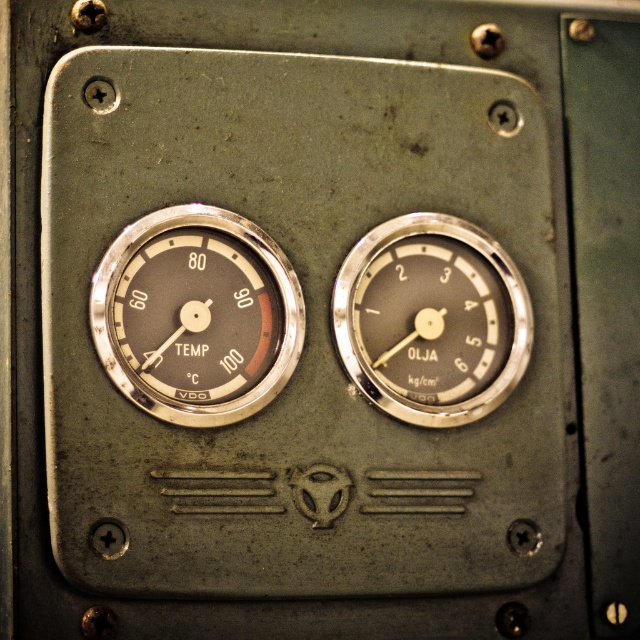
You are a mechanic inspecting a vehicle dashboard. You notice two gauges on the panel. The matte silver gauge at upper left and the metallic silver gauge at center. Which gauge is taller?

The metallic silver gauge at center is taller than the matte silver gauge at upper left.

From the picture: You are a mechanic inspecting a vehicle panel. You see the matte silver gauge at upper left and the metallic silver gauge at center. Which gauge is located to the left of the other?

The matte silver gauge at upper left is positioned on the left side of metallic silver gauge at center.

You are a mechanic inspecting a vehicle dashboard. You see the matte silver gauge at upper left and the metallic silver gauge at center. Which gauge is positioned higher on the panel?

The matte silver gauge at upper left is positioned higher on the panel than the metallic silver gauge at center.